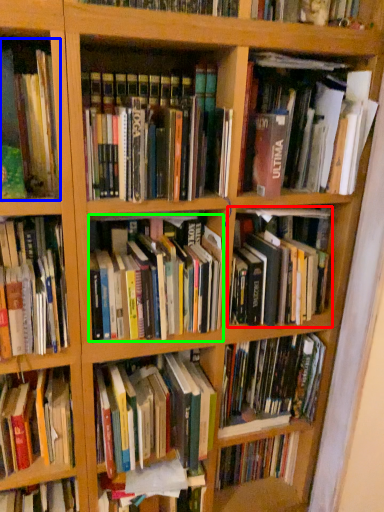
Question: Considering the real-world distances, which object is farthest from book (highlighted by a red box)? book (highlighted by a blue box) or book (highlighted by a green box)?

Choices:
 (A) book
 (B) book

Answer: (A)